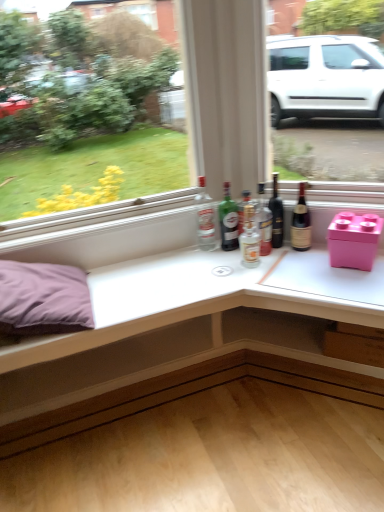
Where is `free space in front of pink plastic storage box at right`? free space in front of pink plastic storage box at right is located at coordinates (344, 286).